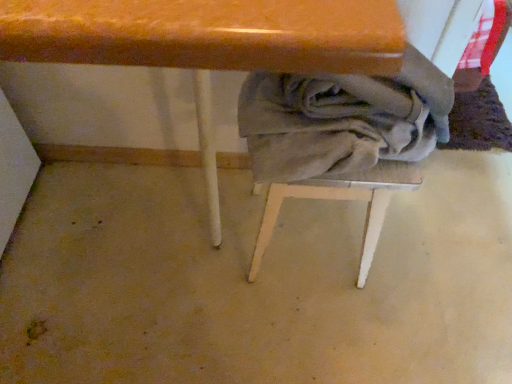
Question: Is gray fabric-covered stool at center not inside wooden table at center?

Choices:
 (A) no
 (B) yes

Answer: (A)

Question: Is gray fabric-covered stool at center aimed at wooden table at center?

Choices:
 (A) yes
 (B) no

Answer: (B)

Question: Considering the relative sizes of gray fabric-covered stool at center and wooden table at center in the image provided, is gray fabric-covered stool at center taller than wooden table at center?

Choices:
 (A) no
 (B) yes

Answer: (A)

Question: Does gray fabric-covered stool at center have a lesser width compared to wooden table at center?

Choices:
 (A) no
 (B) yes

Answer: (B)

Question: Does gray fabric-covered stool at center have a lesser height compared to wooden table at center?

Choices:
 (A) yes
 (B) no

Answer: (A)

Question: Would you say wooden table at center is inside or outside gray fabric-covered stool at center?

Choices:
 (A) inside
 (B) outside

Answer: (B)

Question: Is wooden table at center taller or shorter than gray fabric-covered stool at center?

Choices:
 (A) tall
 (B) short

Answer: (A)

Question: From the image's perspective, is wooden table at center located above or below gray fabric-covered stool at center?

Choices:
 (A) below
 (B) above

Answer: (B)

Question: Is point (274, 52) positioned closer to the camera than point (369, 201)?

Choices:
 (A) closer
 (B) farther

Answer: (A)

Question: Does point (212, 198) appear closer or farther from the camera than point (426, 114)?

Choices:
 (A) farther
 (B) closer

Answer: (A)

Question: From a real-world perspective, is wooden table at center positioned above or below gray cotton laundry at lower center?

Choices:
 (A) below
 (B) above

Answer: (A)

Question: In the image, is wooden table at center positioned in front of or behind gray cotton laundry at lower center?

Choices:
 (A) front
 (B) behind

Answer: (A)

Question: Visually, is wooden table at center positioned to the left or to the right of gray cotton laundry at lower center?

Choices:
 (A) right
 (B) left

Answer: (B)

Question: From the image's perspective, is gray cotton laundry at lower center located above or below gray fabric-covered stool at center?

Choices:
 (A) above
 (B) below

Answer: (A)

Question: In the image, is gray cotton laundry at lower center positioned in front of or behind gray fabric-covered stool at center?

Choices:
 (A) front
 (B) behind

Answer: (A)